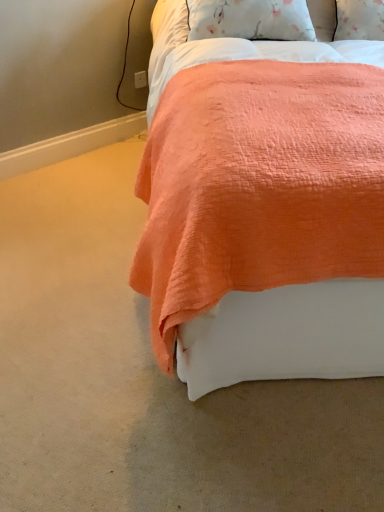
Find the location of a particular element. This screenshot has width=384, height=512. coral quilted bed at center is located at coordinates (265, 211).

The width and height of the screenshot is (384, 512). What do you see at coordinates (265, 211) in the screenshot?
I see `coral quilted bed at center` at bounding box center [265, 211].

In order to face coral quilted bed at center, should I rotate leftwards or rightwards?

Turn right approximately 17.979 degrees to face it.

You are a GUI agent. You are given a task and a screenshot of the screen. Output one action in this format:
    pyautogui.click(x=<x>, y=<y>)
    Task: Click on the coral quilted bed at center
    The image size is (384, 512).
    Given the screenshot: What is the action you would take?
    pyautogui.click(x=265, y=211)